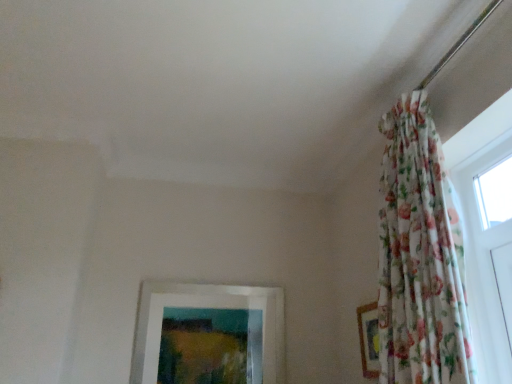
Measure the distance between point (428, 301) and camera.

Point (428, 301) and camera are 1.51 meters apart from each other.

The height and width of the screenshot is (384, 512). What do you see at coordinates (495, 193) in the screenshot? I see `transparent glass window at upper right` at bounding box center [495, 193].

Locate an element on the screen. The image size is (512, 384). white matte picture frame at lower center, the 1th picture frame when ordered from back to front is located at coordinates (208, 307).

Which object is further away from the camera, transparent glass window at upper right or floral fabric picture frame at right, which ranks as the 2th picture frame in left-to-right order?

floral fabric picture frame at right, which ranks as the 2th picture frame in left-to-right order, is behind.

Is transparent glass window at upper right facing away from floral fabric picture frame at right, positioned as the 1th picture frame in right-to-left order?

No, transparent glass window at upper right is not facing away from floral fabric picture frame at right, positioned as the 1th picture frame in right-to-left order.

Between transparent glass window at upper right and floral fabric picture frame at right, positioned as the 1th picture frame in right-to-left order, which one appears on the left side from the viewer's perspective?

floral fabric picture frame at right, positioned as the 1th picture frame in right-to-left order.

Is white matte picture frame at lower center, the 1th picture frame when ordered from left to right, taller than floral fabric picture frame at right, placed as the 1th picture frame when sorted from front to back?

Yes, white matte picture frame at lower center, the 1th picture frame when ordered from left to right, is taller than floral fabric picture frame at right, placed as the 1th picture frame when sorted from front to back.

Is there a large distance between white matte picture frame at lower center, the 1th picture frame when ordered from left to right, and floral fabric picture frame at right, placed as the 1th picture frame when sorted from front to back?

No, there isn't a large distance between white matte picture frame at lower center, the 1th picture frame when ordered from left to right, and floral fabric picture frame at right, placed as the 1th picture frame when sorted from front to back.

Does white matte picture frame at lower center, the 1th picture frame when ordered from left to right, have a greater width compared to floral fabric picture frame at right, which ranks as the 2th picture frame in left-to-right order?

Yes.

Is floral fabric curtain at upper right not near white matte picture frame at lower center, acting as the 2th picture frame starting from the right?

Yes, floral fabric curtain at upper right is far from white matte picture frame at lower center, acting as the 2th picture frame starting from the right.

From a real-world perspective, is floral fabric curtain at upper right beneath white matte picture frame at lower center, the 2th picture frame when ordered from front to back?

Actually, floral fabric curtain at upper right is physically above white matte picture frame at lower center, the 2th picture frame when ordered from front to back, in the real world.

Which is further, (429,365) or (144,377)?

The point (144,377) is farther from the camera.

At what (x,y) coordinates should I click in order to perform the action: click on the 1st picture frame located beneath the floral fabric curtain at upper right (from a real-world perspective). Please return your answer as a coordinate pair (x, y). This screenshot has width=512, height=384. Looking at the image, I should click on (208, 307).

From a real-world perspective, between transparent glass window at upper right and white matte picture frame at lower center, the 1th picture frame when ordered from left to right, who is vertically lower?

In real-world perspective, white matte picture frame at lower center, the 1th picture frame when ordered from left to right, is lower.

In the image, is transparent glass window at upper right on the left side or the right side of white matte picture frame at lower center, the 1th picture frame when ordered from left to right?

transparent glass window at upper right is positioned on white matte picture frame at lower center, the 1th picture frame when ordered from left to right,'s right side.

Which of these two, transparent glass window at upper right or white matte picture frame at lower center, the 1th picture frame when ordered from left to right, is bigger?

Bigger between the two is white matte picture frame at lower center, the 1th picture frame when ordered from left to right.

From the image's perspective, which is below, white matte picture frame at lower center, the 1th picture frame when ordered from left to right, or transparent glass window at upper right?

white matte picture frame at lower center, the 1th picture frame when ordered from left to right.

Which point is more forward, (x=198, y=289) or (x=482, y=202)?

Point (x=482, y=202)

Does white matte picture frame at lower center, acting as the 2th picture frame starting from the right, have a larger size compared to transparent glass window at upper right?

Indeed, white matte picture frame at lower center, acting as the 2th picture frame starting from the right, has a larger size compared to transparent glass window at upper right.

From a real-world perspective, is white matte picture frame at lower center, acting as the 2th picture frame starting from the right, beneath transparent glass window at upper right?

Yes, from a real-world perspective, white matte picture frame at lower center, acting as the 2th picture frame starting from the right, is beneath transparent glass window at upper right.

Is floral fabric curtain at upper right taller or shorter than floral fabric picture frame at right, the second picture frame positioned from the back?

In the image, floral fabric curtain at upper right appears to be taller than floral fabric picture frame at right, the second picture frame positioned from the back.

Is floral fabric curtain at upper right to the right of floral fabric picture frame at right, the second picture frame positioned from the back, from the viewer's perspective?

No, floral fabric curtain at upper right is not to the right of floral fabric picture frame at right, the second picture frame positioned from the back.

Is floral fabric curtain at upper right looking in the opposite direction of floral fabric picture frame at right, the second picture frame positioned from the back?

No.

How many degrees apart are the facing directions of floral fabric curtain at upper right and floral fabric picture frame at right, placed as the 1th picture frame when sorted from front to back?

0.501 degrees.

Based on the photo, which object is positioned more to the right, white matte picture frame at lower center, the 1th picture frame when ordered from back to front, or floral fabric curtain at upper right?

From the viewer's perspective, floral fabric curtain at upper right appears more on the right side.

Is white matte picture frame at lower center, the 1th picture frame when ordered from left to right, oriented towards floral fabric curtain at upper right?

Yes, white matte picture frame at lower center, the 1th picture frame when ordered from left to right, is aimed at floral fabric curtain at upper right.

From the image's perspective, is white matte picture frame at lower center, the 1th picture frame when ordered from left to right, located beneath floral fabric curtain at upper right?

Yes.

Between white matte picture frame at lower center, acting as the 2th picture frame starting from the right, and floral fabric curtain at upper right, which one has less height?

white matte picture frame at lower center, acting as the 2th picture frame starting from the right, is shorter.

The width and height of the screenshot is (512, 384). What are the coordinates of `window in front of the floral fabric picture frame at right, positioned as the 1th picture frame in right-to-left order` in the screenshot? It's located at (495, 193).

Find the location of `picture frame located behind the floral fabric picture frame at right, the second picture frame positioned from the back`. picture frame located behind the floral fabric picture frame at right, the second picture frame positioned from the back is located at coordinates pyautogui.click(x=208, y=307).

Considering their positions, is transparent glass window at upper right positioned closer to white matte picture frame at lower center, the 1th picture frame when ordered from back to front, than floral fabric curtain at upper right?

Among the two, floral fabric curtain at upper right is located nearer to white matte picture frame at lower center, the 1th picture frame when ordered from back to front.

Considering their positions, is floral fabric curtain at upper right positioned further to transparent glass window at upper right than white matte picture frame at lower center, the 2th picture frame when ordered from front to back?

Among the two, white matte picture frame at lower center, the 2th picture frame when ordered from front to back, is located further to transparent glass window at upper right.

Looking at the image, which one is located closer to floral fabric picture frame at right, positioned as the 1th picture frame in right-to-left order, floral fabric curtain at upper right or white matte picture frame at lower center, acting as the 2th picture frame starting from the right?

Based on the image, floral fabric curtain at upper right appears to be nearer to floral fabric picture frame at right, positioned as the 1th picture frame in right-to-left order.

Based on their spatial positions, is transparent glass window at upper right or white matte picture frame at lower center, the 1th picture frame when ordered from left to right, closer to floral fabric picture frame at right, positioned as the 1th picture frame in right-to-left order?

white matte picture frame at lower center, the 1th picture frame when ordered from left to right, lies closer to floral fabric picture frame at right, positioned as the 1th picture frame in right-to-left order, than the other object.

Estimate the real-world distances between objects in this image. Which object is closer to white matte picture frame at lower center, the 1th picture frame when ordered from back to front, floral fabric curtain at upper right or floral fabric picture frame at right, the second picture frame positioned from the back?

The object closer to white matte picture frame at lower center, the 1th picture frame when ordered from back to front, is floral fabric picture frame at right, the second picture frame positioned from the back.

Considering their positions, is floral fabric picture frame at right, placed as the 1th picture frame when sorted from front to back, positioned closer to floral fabric curtain at upper right than white matte picture frame at lower center, the 1th picture frame when ordered from left to right?

floral fabric picture frame at right, placed as the 1th picture frame when sorted from front to back, is positioned closer to the anchor floral fabric curtain at upper right.

Looking at the image, which one is located closer to white matte picture frame at lower center, acting as the 2th picture frame starting from the right, floral fabric picture frame at right, the second picture frame positioned from the back, or transparent glass window at upper right?

The object closer to white matte picture frame at lower center, acting as the 2th picture frame starting from the right, is floral fabric picture frame at right, the second picture frame positioned from the back.

Looking at the image, which one is located further to white matte picture frame at lower center, the 1th picture frame when ordered from back to front, floral fabric curtain at upper right or transparent glass window at upper right?

transparent glass window at upper right.

Locate an element on the screen. Image resolution: width=512 pixels, height=384 pixels. picture frame positioned between floral fabric curtain at upper right and white matte picture frame at lower center, the 2th picture frame when ordered from front to back, from near to far is located at coordinates (369, 339).

This screenshot has width=512, height=384. Identify the location of picture frame between white matte picture frame at lower center, the 1th picture frame when ordered from back to front, and transparent glass window at upper right from left to right. (369, 339).

Where is `curtain situated between white matte picture frame at lower center, the 2th picture frame when ordered from front to back, and transparent glass window at upper right from left to right`? curtain situated between white matte picture frame at lower center, the 2th picture frame when ordered from front to back, and transparent glass window at upper right from left to right is located at coordinates (419, 256).

Find the location of `curtain between transparent glass window at upper right and floral fabric picture frame at right, the second picture frame positioned from the back, vertically`. curtain between transparent glass window at upper right and floral fabric picture frame at right, the second picture frame positioned from the back, vertically is located at coordinates (419, 256).